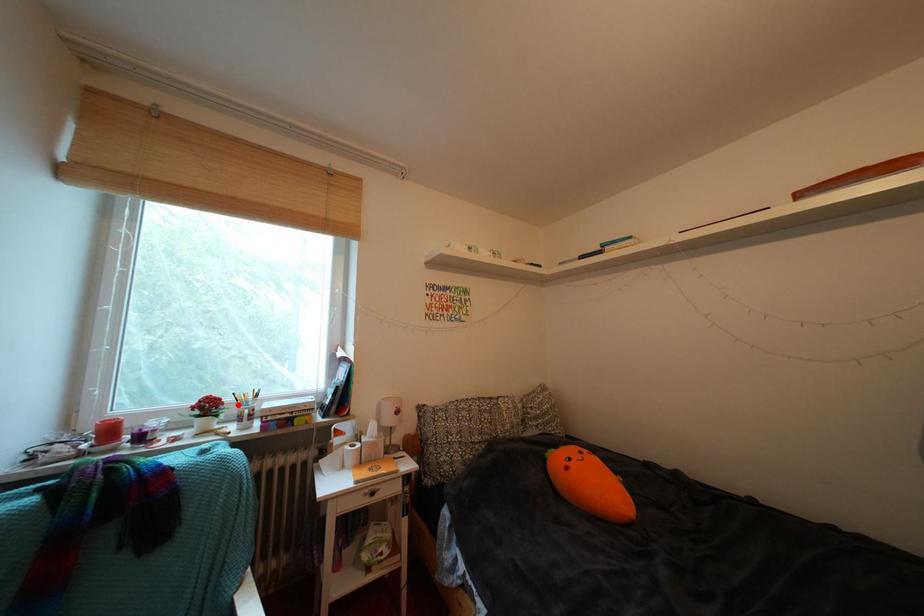
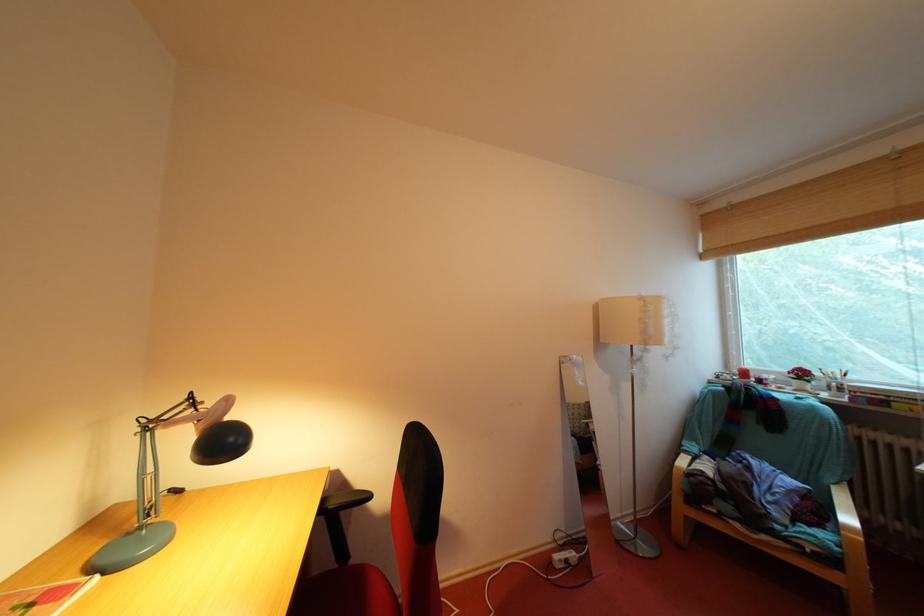
Find the pixel in the second image that matches the highlighted location in the first image.

(829, 379)